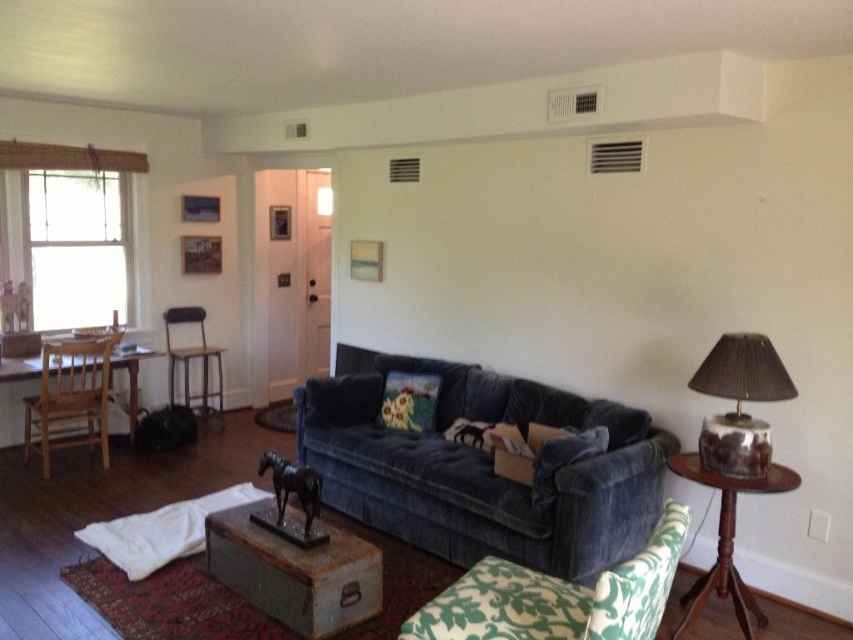
Is point (721, 474) positioned after point (71, 420)?

That is False.

Find the location of `marble lampshade at right`. marble lampshade at right is located at coordinates (740, 403).

Locate an element on the screen. The width and height of the screenshot is (853, 640). marble lampshade at right is located at coordinates (740, 403).

Is marble lampshade at right positioned at the back of velvet floral pillow at center?

That is False.

Consider the image. Does marble lampshade at right have a lesser height compared to velvet floral pillow at center?

No, marble lampshade at right is not shorter than velvet floral pillow at center.

Between point (752, 468) and point (325, 403), which one is positioned behind?

The point (325, 403) is more distant.

Identify the location of marble lampshade at right. This screenshot has height=640, width=853. (740, 403).

Between green floral fabric armchair at lower right and wooden chair at left, which one has less height?

green floral fabric armchair at lower right is shorter.

Who is higher up, green floral fabric armchair at lower right or wooden chair at left?

wooden chair at left

Is point (537, 586) farther from viewer compared to point (77, 420)?

That is False.

At what (x,y) coordinates should I click in order to perform the action: click on green floral fabric armchair at lower right. Please return your answer as a coordinate pair (x, y). The height and width of the screenshot is (640, 853). Looking at the image, I should click on (558, 596).